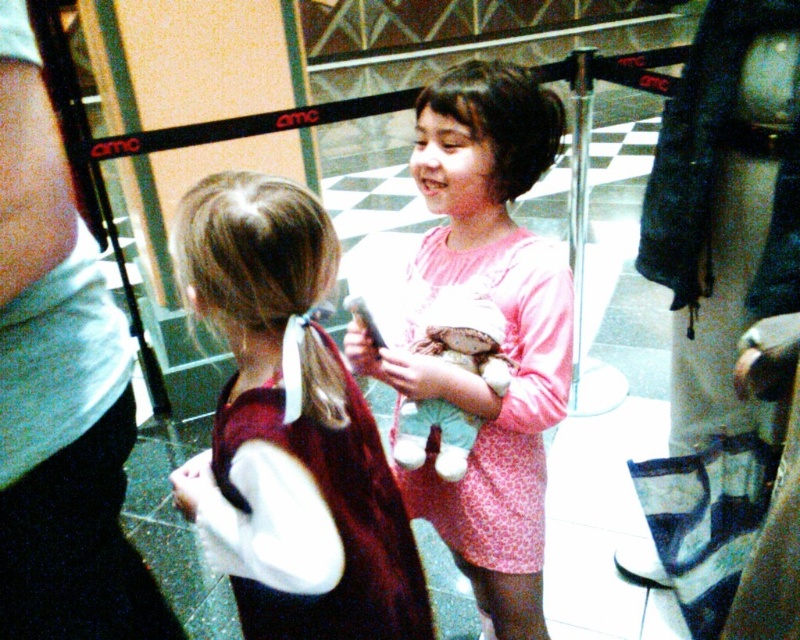
Question: Is maroon velvet dress at center behind fluffy plush toy at center?

Choices:
 (A) yes
 (B) no

Answer: (B)

Question: Among these points, which one is farthest from the camera?

Choices:
 (A) (137, 602)
 (B) (546, 246)
 (C) (240, 596)

Answer: (A)

Question: In this image, where is white cotton shirt at upper left located relative to pink fabric dress at center?

Choices:
 (A) above
 (B) below

Answer: (A)

Question: Where is pink fabric dress at center located in relation to fluffy plush toy at center in the image?

Choices:
 (A) right
 (B) left

Answer: (A)

Question: Which object is the closest to the fluffy plush toy at center?

Choices:
 (A) pink fabric dress at center
 (B) white cotton shirt at upper left
 (C) maroon velvet dress at center

Answer: (A)

Question: Which point is closer to the camera?

Choices:
 (A) (214, 486)
 (B) (456, 324)
 (C) (92, 282)
 (D) (452, 500)

Answer: (C)